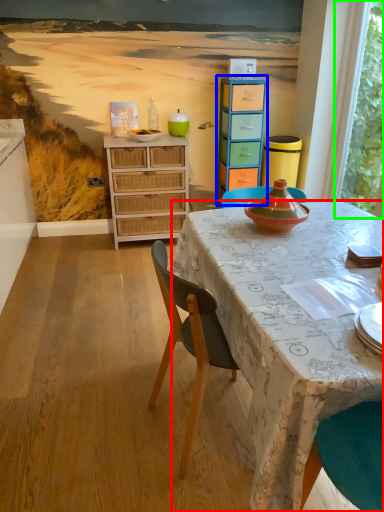
Question: Based on their relative distances, which object is nearer to desk (highlighted by a red box)? Choose from cabinetry (highlighted by a blue box) and window screen (highlighted by a green box).

Choices:
 (A) cabinetry
 (B) window screen

Answer: (A)